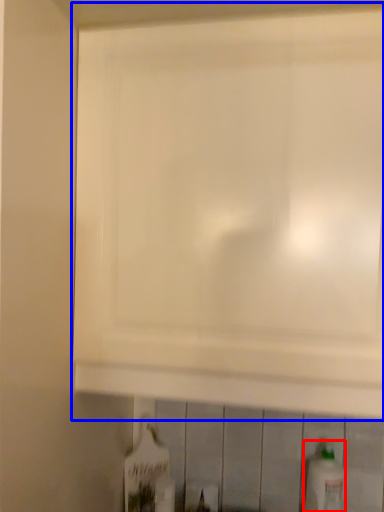
Question: Among these objects, which one is nearest to the camera, bottle (highlighted by a red box) or cabinetry (highlighted by a blue box)?

Choices:
 (A) bottle
 (B) cabinetry

Answer: (B)